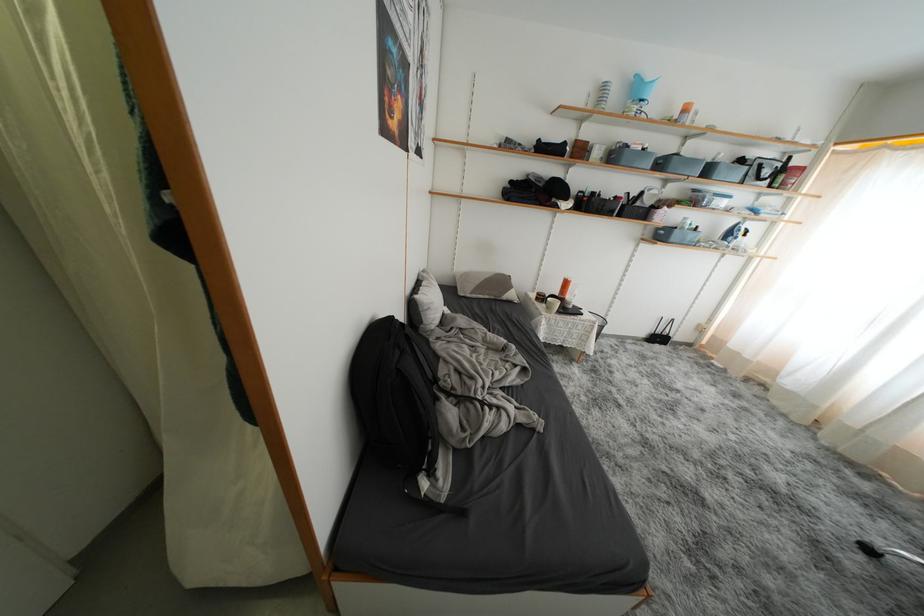
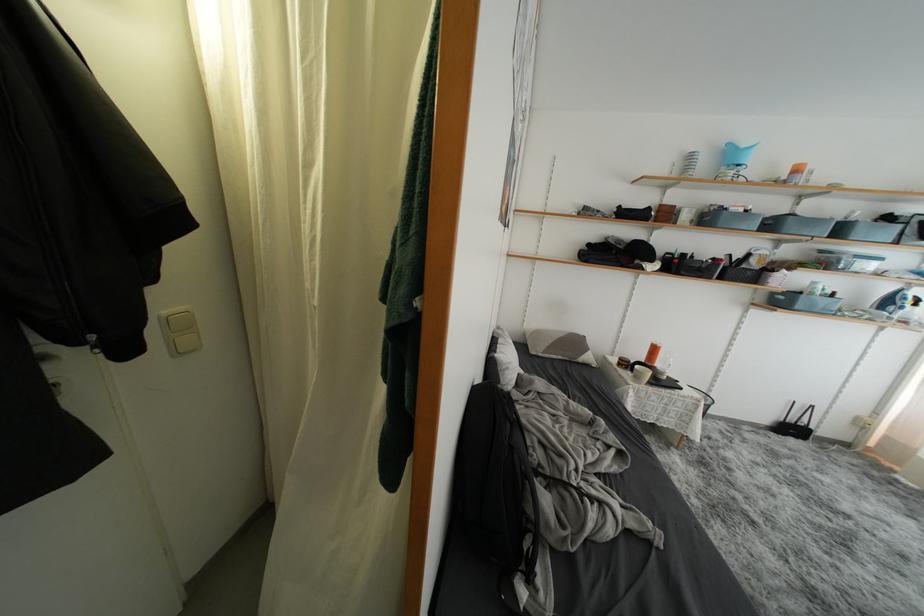
The point at (554, 313) is marked in the first image. Where is the corresponding point in the second image?

(642, 382)